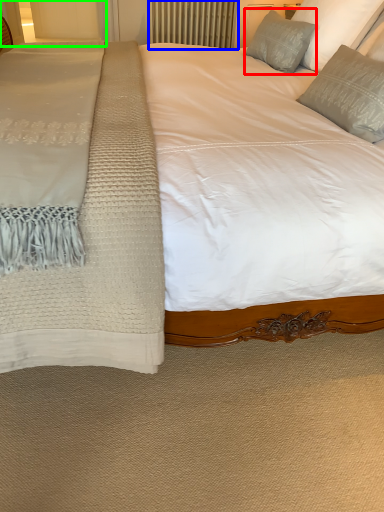
Question: Which object is positioned farthest from pillow (highlighted by a red box)? Select from radiator (highlighted by a blue box) and glass door (highlighted by a green box).

Choices:
 (A) radiator
 (B) glass door

Answer: (A)